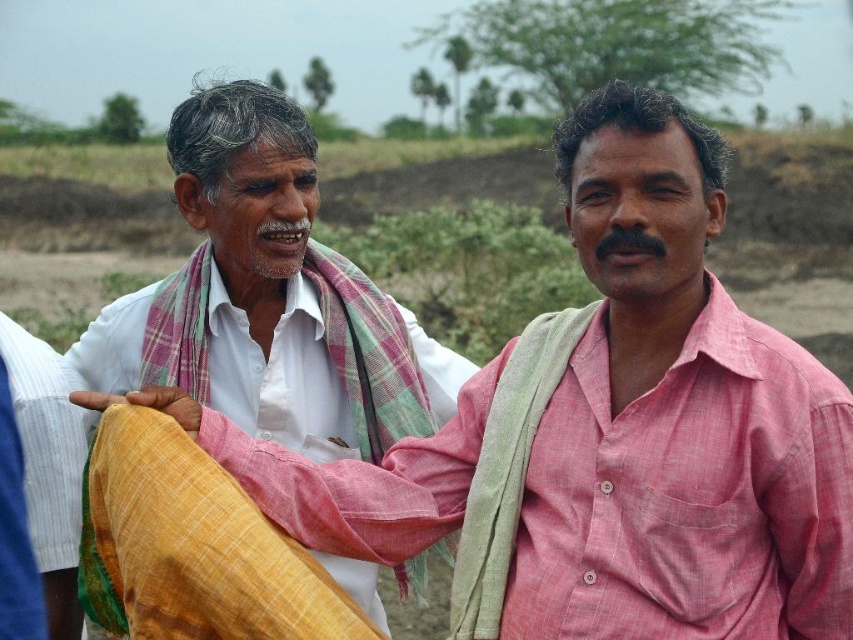
Question: Which point appears farthest from the camera in this image?

Choices:
 (A) (207, 632)
 (B) (199, 141)

Answer: (B)

Question: Does white cotton shirt at left have a larger size compared to yellow woven cloth at center?

Choices:
 (A) no
 (B) yes

Answer: (B)

Question: Which point is farther to the camera?

Choices:
 (A) yellow woven cloth at center
 (B) white cotton shirt at left

Answer: (B)

Question: Can you confirm if white cotton shirt at left is positioned below yellow woven cloth at center?

Choices:
 (A) no
 (B) yes

Answer: (A)

Question: Observing the image, what is the correct spatial positioning of white cotton shirt at left in reference to yellow woven cloth at center?

Choices:
 (A) left
 (B) right

Answer: (A)